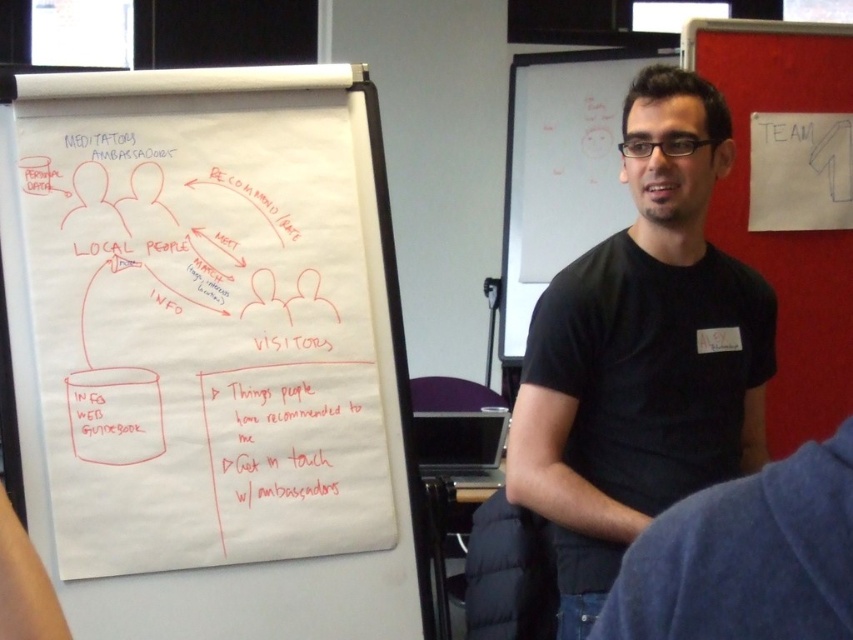
What is the relationship between the white paper at left and the red fabric bulletin board at upper right in terms of height?

The white paper at left is much taller than the red fabric bulletin board at upper right.